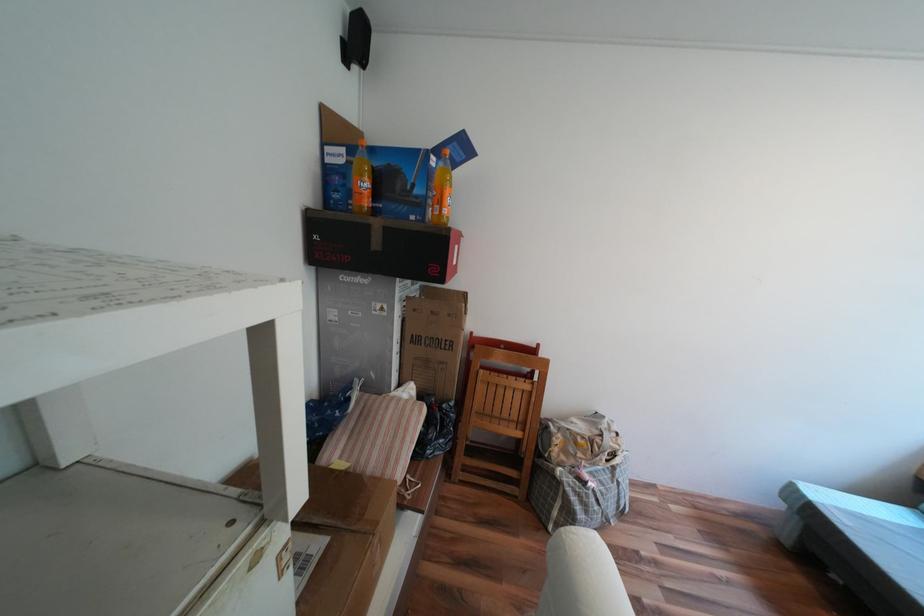
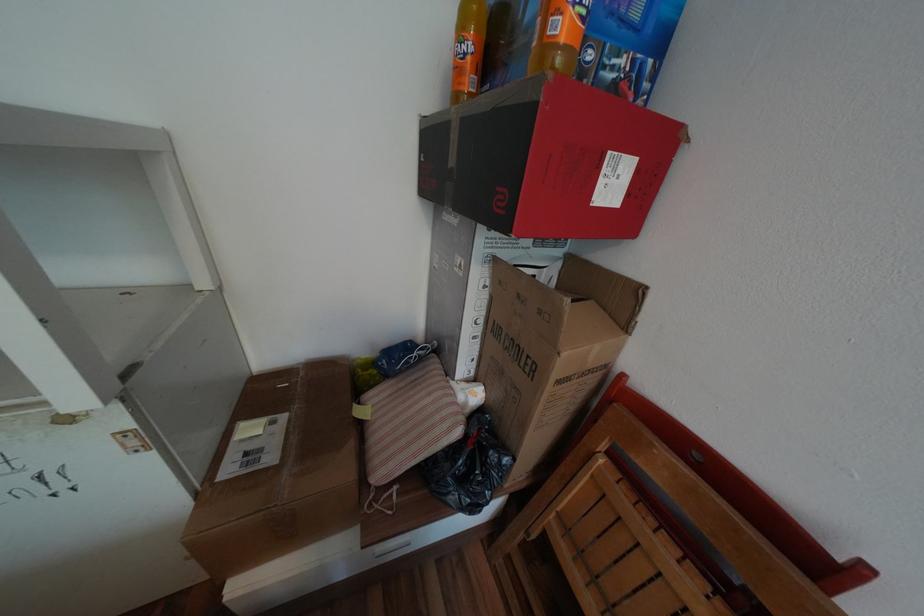
In the second image, find the point that corresponds to [371,175] in the first image.

(472, 31)